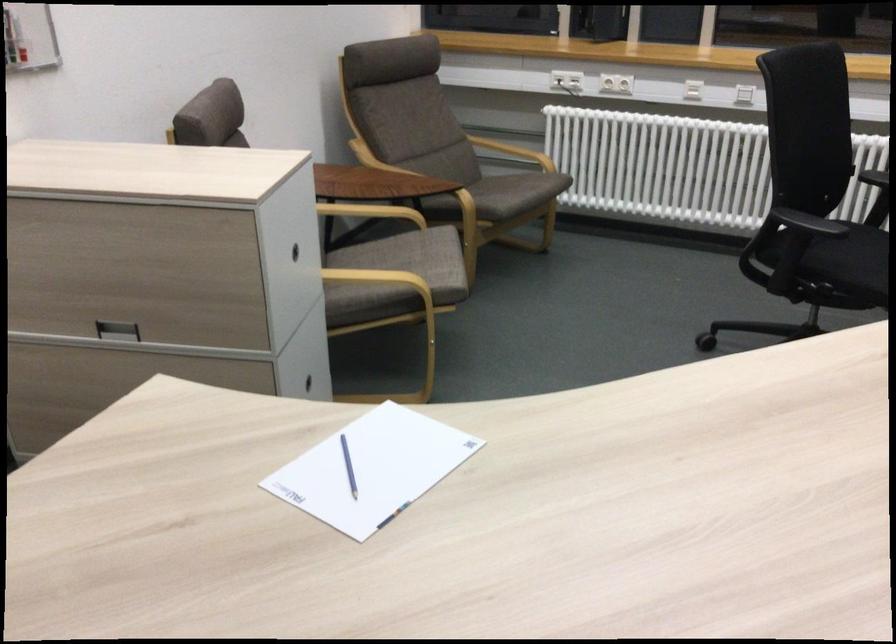
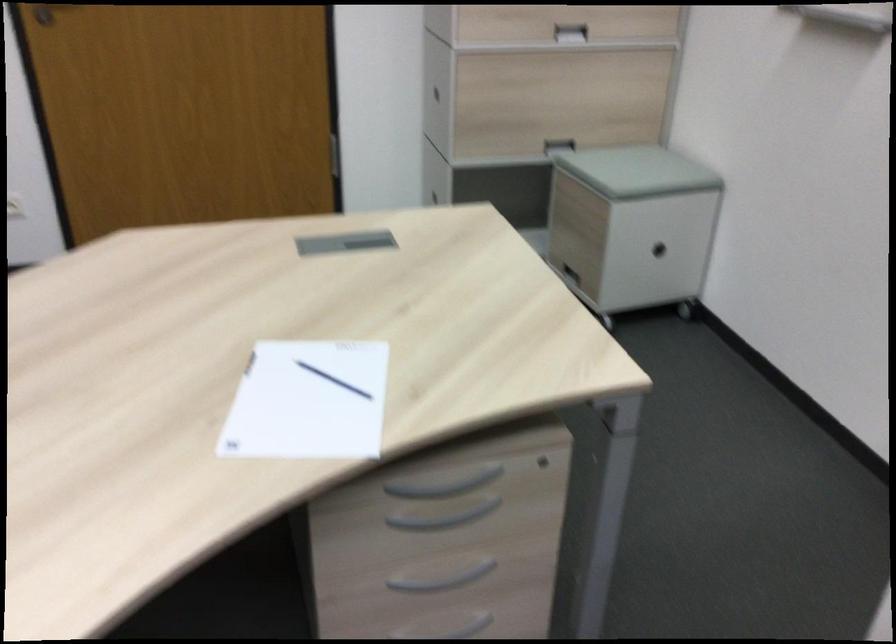
In the second image, find the point that corresponds to (375,471) in the first image.

(307, 402)